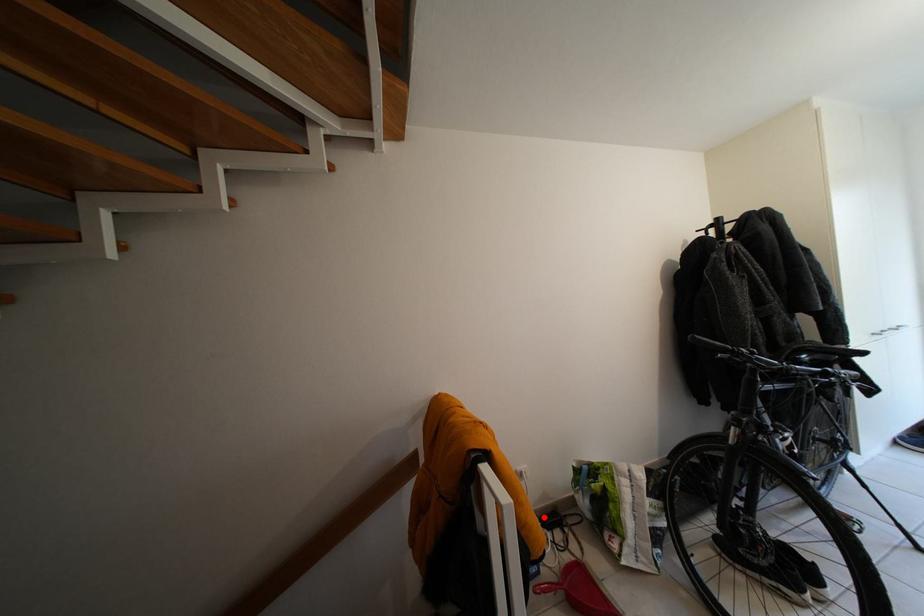
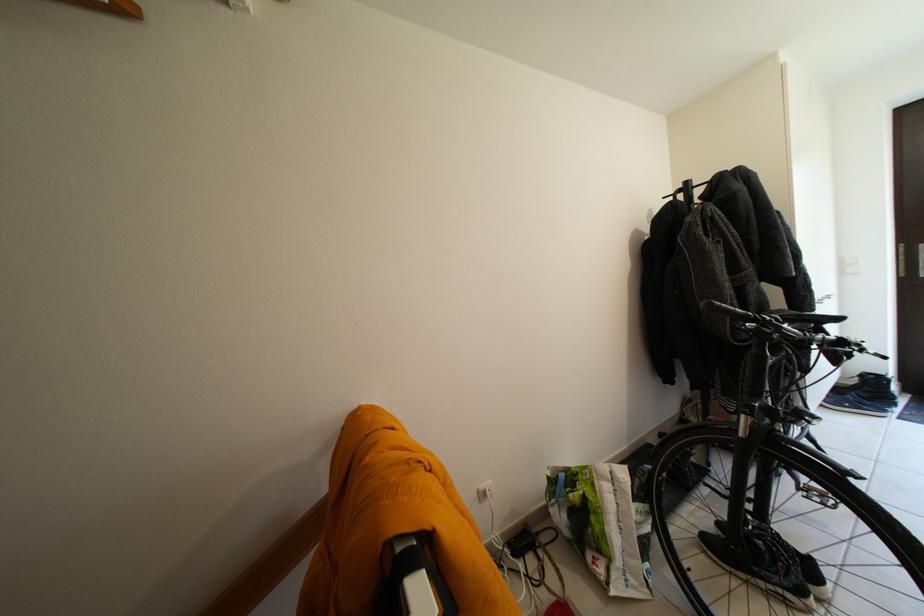
Question: I am providing you with two images of the same scene from different viewpoints. In image1, a red point is highlighted. Considering the same 3D point in image2, which of the following is correct?

Choices:
 (A) It is closer
 (B) It is farther

Answer: (A)